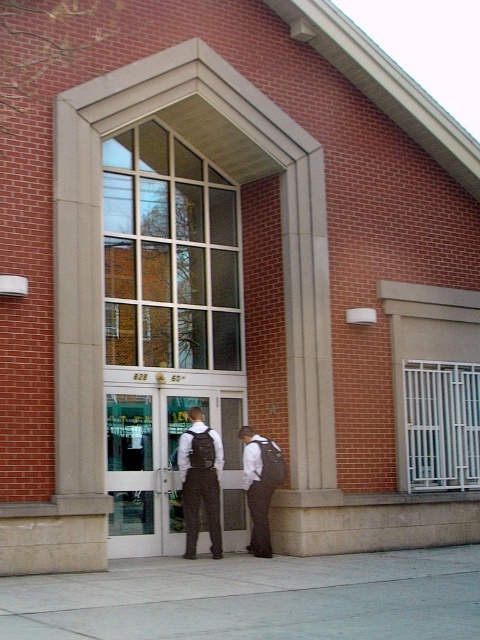
Which is in front, point (162, 628) or point (267, 452)?

Point (162, 628) is more forward.

Who is positioned more to the left, gray concrete pavement at lower center or dark brown fabric vest at center?

dark brown fabric vest at center

The height and width of the screenshot is (640, 480). I want to click on gray concrete pavement at lower center, so pos(254,598).

The width and height of the screenshot is (480, 640). Find the location of `gray concrete pavement at lower center`. gray concrete pavement at lower center is located at coordinates (254, 598).

Is point (256, 492) closer to viewer compared to point (195, 458)?

No, it is not.

Which is in front, point (276, 486) or point (200, 436)?

Point (276, 486) is in front.

The width and height of the screenshot is (480, 640). In order to click on dark gray backpack at center in this screenshot , I will do `click(260, 486)`.

Is point (213, 534) positioned before point (263, 461)?

Yes, point (213, 534) is in front of point (263, 461).

You are a GUI agent. You are given a task and a screenshot of the screen. Output one action in this format:
    pyautogui.click(x=<x>, y=<y>)
    Task: Click on the dark gray overalls at center
    Image resolution: width=480 pixels, height=640 pixels.
    Given the screenshot: What is the action you would take?
    pyautogui.click(x=201, y=481)

The width and height of the screenshot is (480, 640). I want to click on dark gray overalls at center, so click(201, 481).